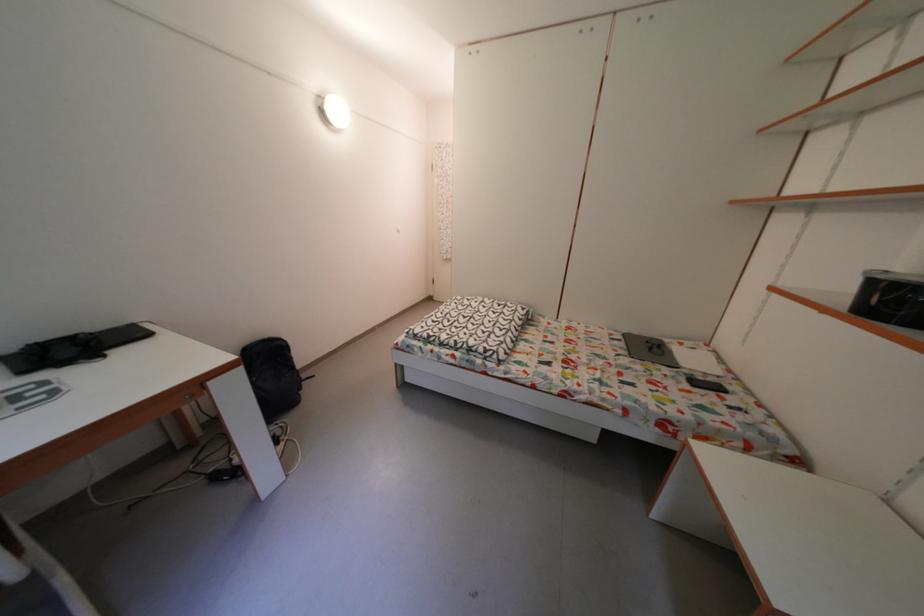
Find where to pull the white drawer handle. Please return your answer as a coordinate pair (x, y).

(188, 397)